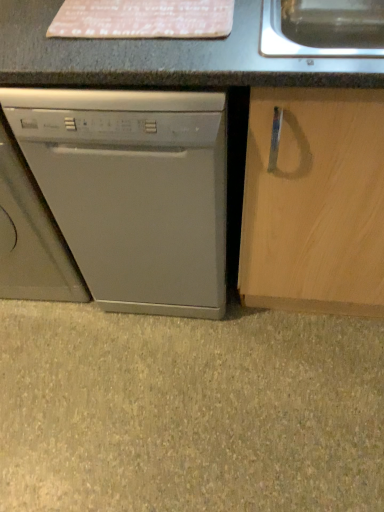
Question: Is gray matte dishwasher at lower left spatially inside satin silver dishwasher at left, or outside of it?

Choices:
 (A) inside
 (B) outside

Answer: (B)

Question: Visually, is gray matte dishwasher at lower left positioned to the left or to the right of satin silver dishwasher at left?

Choices:
 (A) left
 (B) right

Answer: (B)

Question: From their relative heights in the image, would you say gray matte dishwasher at lower left is taller or shorter than satin silver dishwasher at left?

Choices:
 (A) short
 (B) tall

Answer: (A)

Question: Does point (183, 288) appear closer or farther from the camera than point (3, 382)?

Choices:
 (A) farther
 (B) closer

Answer: (B)

Question: Based on their positions, is satin silver dishwasher at left located to the left or right of gray matte dishwasher at lower left?

Choices:
 (A) left
 (B) right

Answer: (A)

Question: Considering the positions of satin silver dishwasher at left and gray matte dishwasher at lower left in the image, is satin silver dishwasher at left bigger or smaller than gray matte dishwasher at lower left?

Choices:
 (A) small
 (B) big

Answer: (B)

Question: From the image's perspective, relative to gray matte dishwasher at lower left, is satin silver dishwasher at left above or below?

Choices:
 (A) above
 (B) below

Answer: (A)